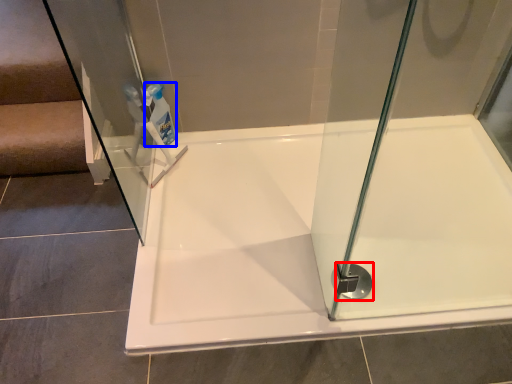
Question: Which object is further to the camera taking this photo, shower (highlighted by a red box) or cleaning product (highlighted by a blue box)?

Choices:
 (A) shower
 (B) cleaning product

Answer: (B)